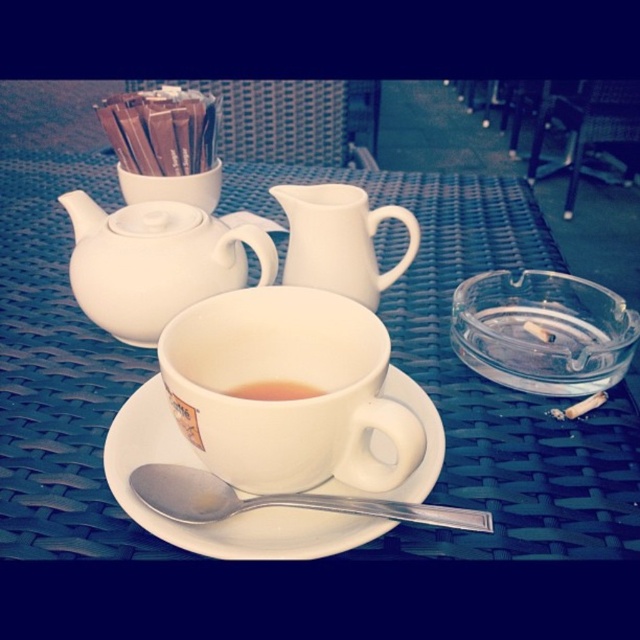
Is point (228, 458) closer to camera compared to point (282, 385)?

Yes.

Measure the distance between point (243, 444) and camera.

Point (243, 444) is 9.11 inches away from camera.

Locate an element on the screen. This screenshot has width=640, height=640. white ceramic cup at center is located at coordinates (285, 401).

Is white matte teapot at upper left above silver metallic spoon at lower center?

Yes.

Does white matte teapot at upper left have a larger size compared to silver metallic spoon at lower center?

Yes, white matte teapot at upper left is bigger than silver metallic spoon at lower center.

Is point (200, 241) farther from camera compared to point (301, 500)?

Yes, point (200, 241) is farther from viewer.

Find the location of a particular element. white matte teapot at upper left is located at coordinates (156, 262).

Can you confirm if white glossy pitcher at center is positioned to the left of silver metallic spoon at lower center?

Incorrect, white glossy pitcher at center is not on the left side of silver metallic spoon at lower center.

Can you confirm if white glossy pitcher at center is smaller than silver metallic spoon at lower center?

Actually, white glossy pitcher at center might be larger than silver metallic spoon at lower center.

Between point (312, 248) and point (316, 508), which one is positioned behind?

The point (312, 248) is more distant.

I want to click on white glossy pitcher at center, so click(x=339, y=241).